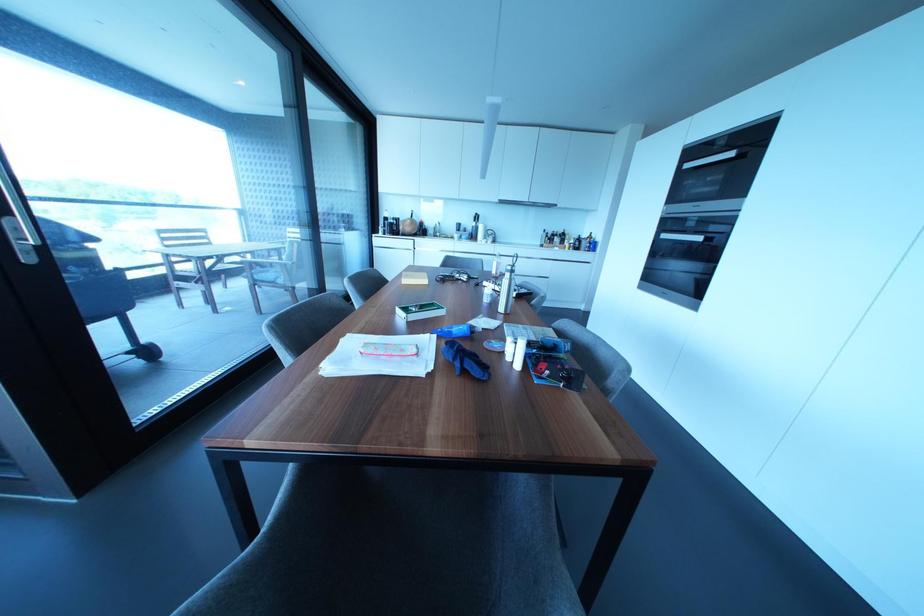
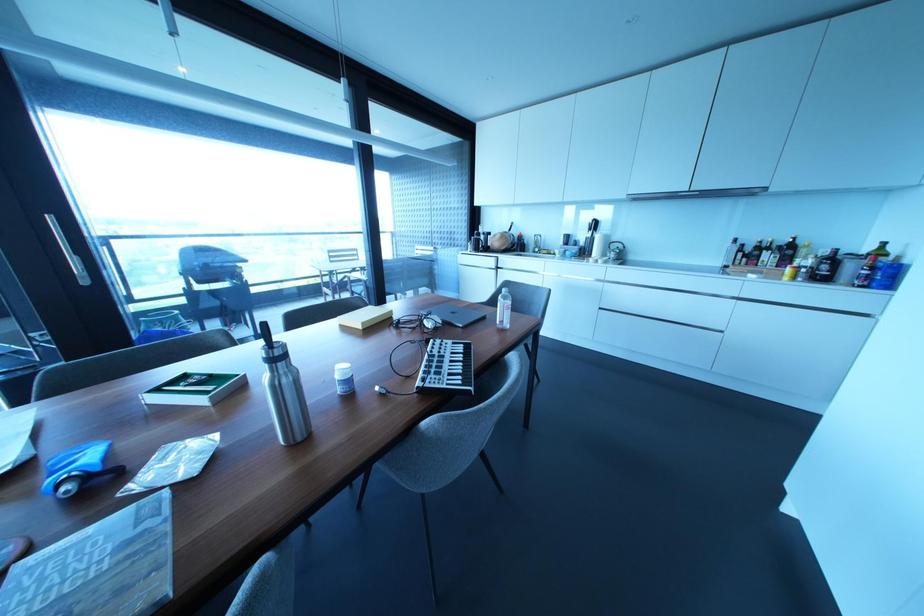
Find the pixel in the second image that matches point 29,257 in the first image.

(83, 281)